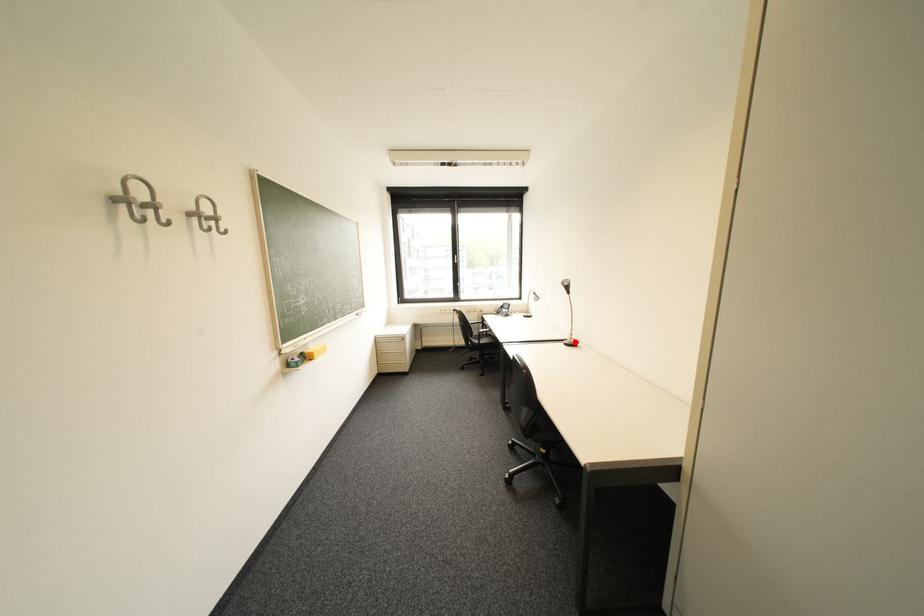
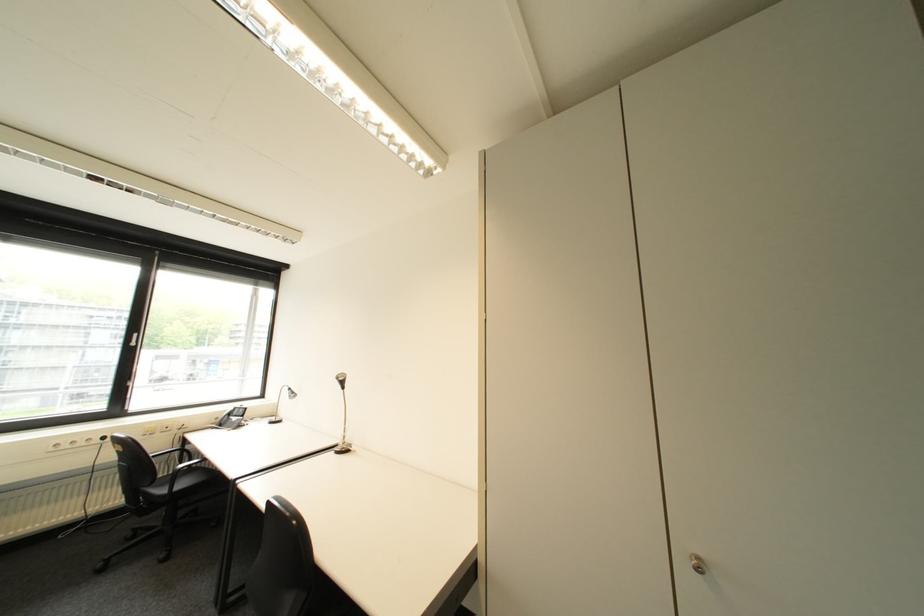
Locate, in the second image, the point that corresponds to the highlighted location in the first image.

(346, 450)